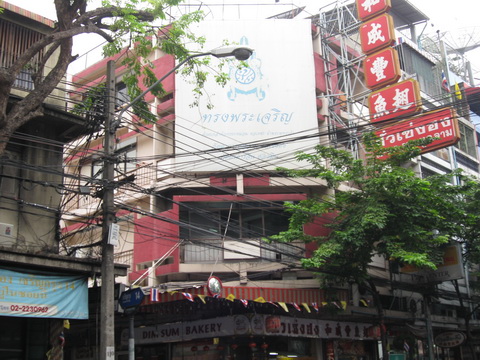
This screenshot has width=480, height=360. In order to click on pennant flag banner in this screenshot , I will do `click(189, 296)`, `click(201, 297)`, `click(260, 298)`, `click(283, 305)`, `click(306, 306)`, `click(314, 305)`, `click(324, 303)`, `click(344, 302)`.